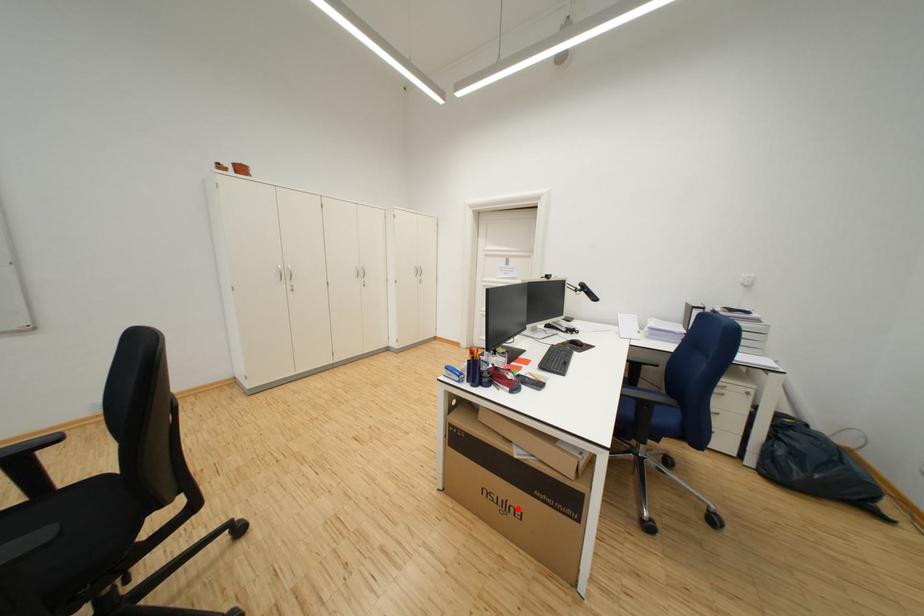
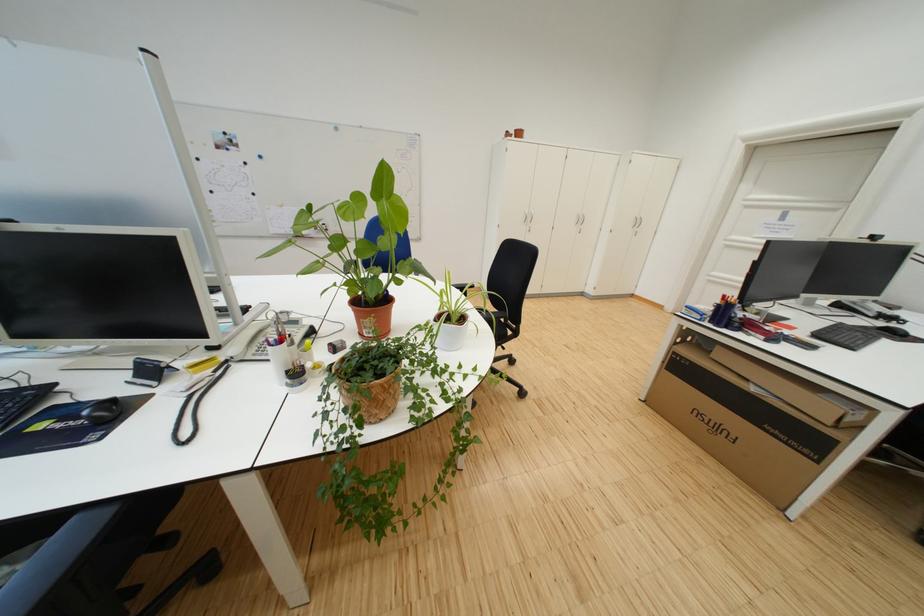
Question: I am providing you with two images of the same scene from different viewpoints. Image1 has a red point marked. In image2, the corresponding 3D location appears at what relative position? Reply with the corresponding letter.

Choices:
 (A) Closer
 (B) Farther

Answer: (A)